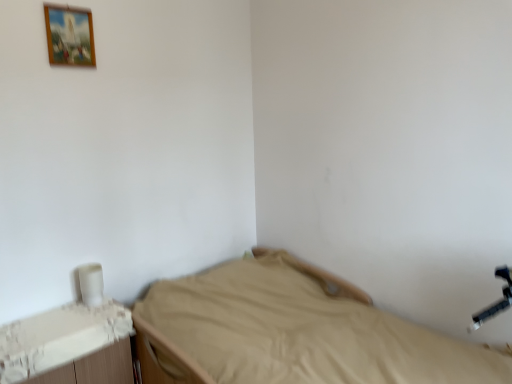
Question: From the image's perspective, is beige fabric bed at center located beneath white plastic changing table at lower left?

Choices:
 (A) yes
 (B) no

Answer: (B)

Question: Is beige fabric bed at center smaller than white plastic changing table at lower left?

Choices:
 (A) no
 (B) yes

Answer: (A)

Question: From a real-world perspective, is beige fabric bed at center physically above white plastic changing table at lower left?

Choices:
 (A) no
 (B) yes

Answer: (A)

Question: From the image's perspective, is beige fabric bed at center on top of white plastic changing table at lower left?

Choices:
 (A) yes
 (B) no

Answer: (A)

Question: Does beige fabric bed at center have a lesser height compared to white plastic changing table at lower left?

Choices:
 (A) yes
 (B) no

Answer: (B)

Question: Does beige fabric bed at center have a greater width compared to white plastic changing table at lower left?

Choices:
 (A) no
 (B) yes

Answer: (B)

Question: Considering the relative positions of white plastic changing table at lower left and wooden picture frame at upper left in the image provided, is white plastic changing table at lower left to the left of wooden picture frame at upper left from the viewer's perspective?

Choices:
 (A) yes
 (B) no

Answer: (A)

Question: Is white plastic changing table at lower left surrounding wooden picture frame at upper left?

Choices:
 (A) yes
 (B) no

Answer: (B)

Question: Is white plastic changing table at lower left taller than wooden picture frame at upper left?

Choices:
 (A) no
 (B) yes

Answer: (B)

Question: Can you confirm if white plastic changing table at lower left is thinner than wooden picture frame at upper left?

Choices:
 (A) no
 (B) yes

Answer: (A)

Question: Is white plastic changing table at lower left oriented towards wooden picture frame at upper left?

Choices:
 (A) no
 (B) yes

Answer: (A)

Question: Considering the relative sizes of white plastic changing table at lower left and wooden picture frame at upper left in the image provided, is white plastic changing table at lower left wider than wooden picture frame at upper left?

Choices:
 (A) no
 (B) yes

Answer: (B)

Question: Is beige fabric bed at center taller than wooden picture frame at upper left?

Choices:
 (A) no
 (B) yes

Answer: (B)